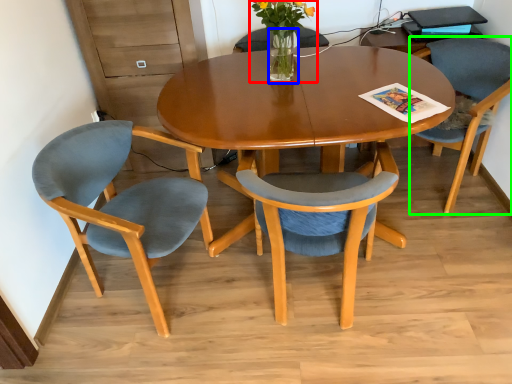
Question: Which object is positioned closest to floral arrangement (highlighted by a red box)? Select from vase (highlighted by a blue box) and chair (highlighted by a green box).

Choices:
 (A) vase
 (B) chair

Answer: (A)